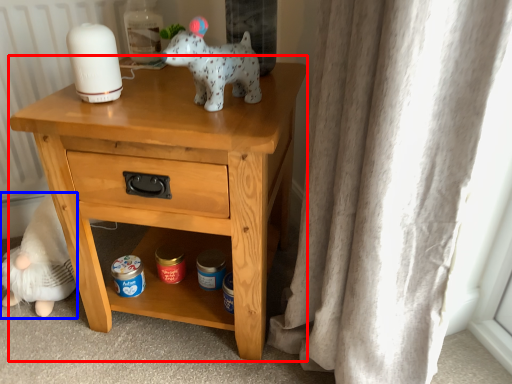
Question: Which of the following is the farthest to the observer, nightstand (highlighted by a red box) or figurine (highlighted by a blue box)?

Choices:
 (A) nightstand
 (B) figurine

Answer: (B)